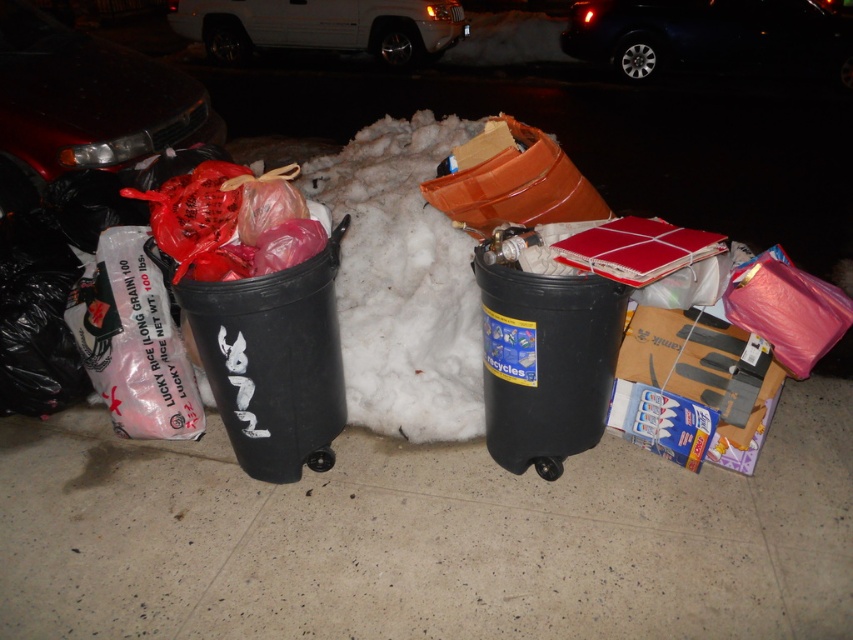
Question: Which object appears closest to the camera in this image?

Choices:
 (A) shiny red car at left
 (B) smooth concrete pavement at center
 (C) black plastic recycling bin at lower right
 (D) shiny black car at upper right

Answer: (B)

Question: Does shiny black car at upper right appear on the right side of white matte van at upper center?

Choices:
 (A) yes
 (B) no

Answer: (A)

Question: Does black plastic trash can at left appear on the left side of shiny black car at upper right?

Choices:
 (A) no
 (B) yes

Answer: (B)

Question: Does shiny red car at left have a smaller size compared to shiny black car at upper right?

Choices:
 (A) no
 (B) yes

Answer: (B)

Question: Estimate the real-world distances between objects in this image. Which object is closer to the shiny red car at left?

Choices:
 (A) white matte van at upper center
 (B) shiny black car at upper right

Answer: (A)

Question: Which of the following is the closest to the observer?

Choices:
 (A) (247, 304)
 (B) (262, 22)
 (C) (115, 157)
 (D) (50, 512)

Answer: (A)